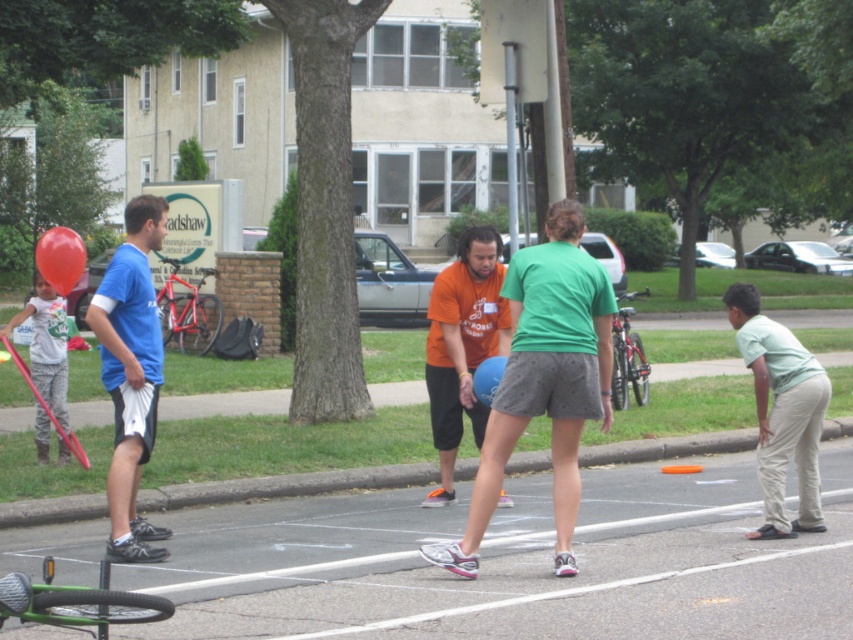
Question: Among these points, which one is farthest from the camera?

Choices:
 (A) (129, 292)
 (B) (57, 292)
 (C) (462, 355)
 (D) (788, 536)

Answer: (B)

Question: Which of the following is the farthest from the observer?

Choices:
 (A) matte gray pants at left
 (B) orange cotton t-shirt at center
 (C) light green cotton shirt at lower right

Answer: (A)

Question: Can you confirm if light green cotton shirt at lower right is smaller than rubber balloon at left?

Choices:
 (A) yes
 (B) no

Answer: (A)

Question: Is orange cotton t-shirt at center smaller than rubber balloon at left?

Choices:
 (A) yes
 (B) no

Answer: (A)

Question: Is matte gray pants at left positioned behind blue rubber balloon at center?

Choices:
 (A) no
 (B) yes

Answer: (B)

Question: Estimate the real-world distances between objects in this image. Which object is farther from the blue rubber balloon at center?

Choices:
 (A) orange cotton t-shirt at center
 (B) blue fabric shorts at left
 (C) matte gray pants at left

Answer: (C)